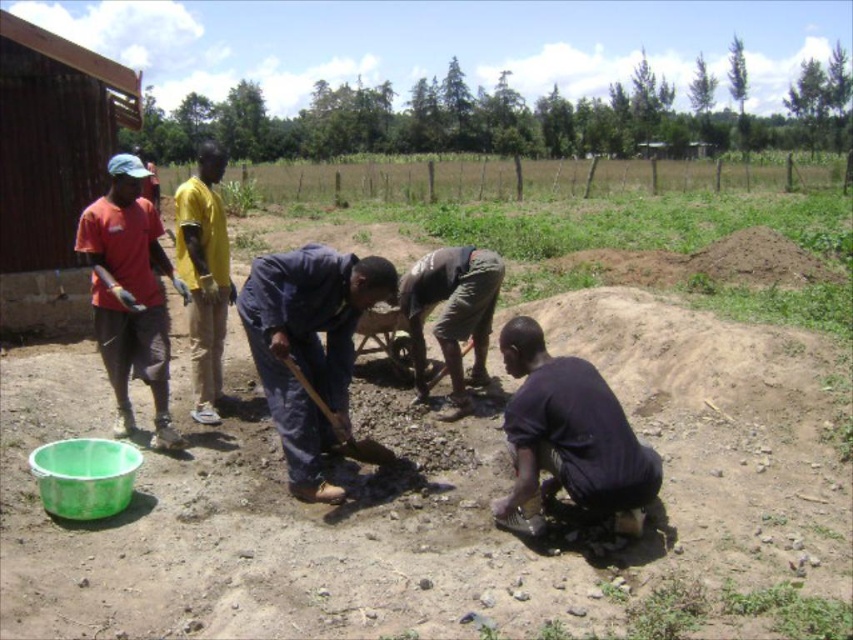
You are standing at the point labeled as point (x=682, y=486) and want to throw a ball to someone standing 5 meters away from you. Can you reach them?

The distance between point (x=682, y=486) and the viewer is 4.56 meters, so yes, you can reach them since the distance is less than 5 meters.

You are standing in the field and want to hand a tool to the person in the dark blue shirt at lower right. Which direction should you move relative to the yellow fabric shirt at center?

You should move to the right of the yellow fabric shirt at center because the dark blue shirt at lower right is located to the right of the yellow fabric shirt at center.